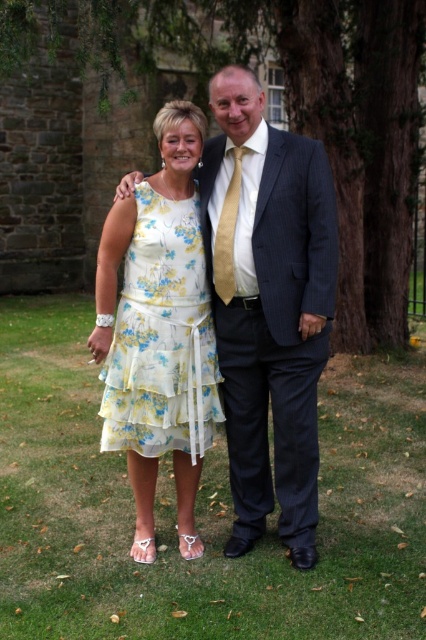
Is point (189, 292) closer to camera compared to point (219, 241)?

No, it is not.

Who is lower down, floral cotton dress at center or gold silk tie at center?

Positioned lower is floral cotton dress at center.

Where is `floral cotton dress at center`? The height and width of the screenshot is (640, 426). floral cotton dress at center is located at coordinates 161,337.

Which of these two, dark blue pinstripe suit at center or floral cotton dress at center, stands taller?

With more height is dark blue pinstripe suit at center.

Can you confirm if dark blue pinstripe suit at center is bigger than floral cotton dress at center?

Correct, dark blue pinstripe suit at center is larger in size than floral cotton dress at center.

Measure the distance between dark blue pinstripe suit at center and camera.

dark blue pinstripe suit at center and camera are 10.69 feet apart from each other.

Locate an element on the screen. dark blue pinstripe suit at center is located at coordinates (276, 332).

Measure the distance between dark blue pinstripe suit at center and gold silk tie at center.

dark blue pinstripe suit at center is 15.44 inches away from gold silk tie at center.

Does dark blue pinstripe suit at center appear on the right side of gold silk tie at center?

Correct, you'll find dark blue pinstripe suit at center to the right of gold silk tie at center.

Is point (241, 444) closer to viewer compared to point (227, 208)?

No, it is behind (227, 208).

Identify the location of dark blue pinstripe suit at center. The height and width of the screenshot is (640, 426). (276, 332).